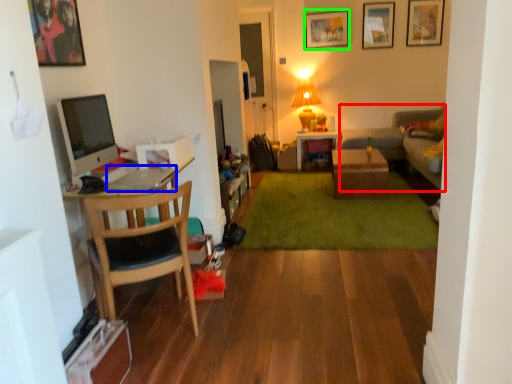
Question: Which is nearer to the couch (highlighted by a red box)? laptop (highlighted by a blue box) or picture frame (highlighted by a green box).

Choices:
 (A) laptop
 (B) picture frame

Answer: (B)